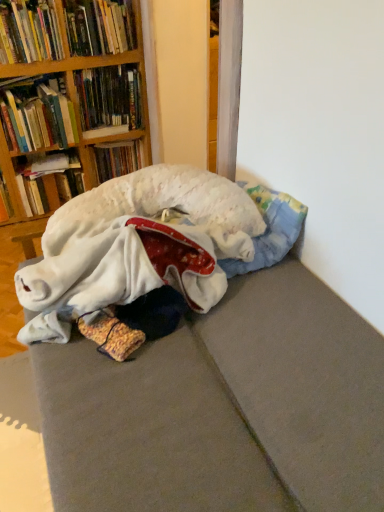
Identify the location of hardcover book at upper left, which ranks as the third book in bottom-to-top order. (118, 159).

Where is `white fluffy dog at center`? This screenshot has width=384, height=512. white fluffy dog at center is located at coordinates (162, 208).

You are a GUI agent. You are given a task and a screenshot of the screen. Output one action in this format:
    pyautogui.click(x=<x>, y=<y>)
    Task: Click on the hardcover book at upper left, the fourth book when ordered from top to bottom
    This screenshot has width=384, height=512.
    Given the screenshot: What is the action you would take?
    pyautogui.click(x=37, y=114)

What is the approximate height of hardcover book at upper left, placed as the 1th book when sorted from top to bottom?

10.44 inches.

Where is `hardcover books at upper left, positioned as the third book in top-to-bottom order`? This screenshot has width=384, height=512. hardcover books at upper left, positioned as the third book in top-to-bottom order is located at coordinates (109, 97).

From the image's perspective, which is below, hardcover book at upper left, marked as the 2th book in a top-to-bottom arrangement, or washed fabric bed at lower left?

From the image's view, washed fabric bed at lower left is below.

In the scene shown: Does hardcover book at upper left, marked as the 2th book in a top-to-bottom arrangement, have a lesser width compared to washed fabric bed at lower left?

Yes.

Is hardcover book at upper left, placed as the sixth book when sorted from bottom to top, facing away from washed fabric bed at lower left?

No, hardcover book at upper left, placed as the sixth book when sorted from bottom to top,'s orientation is not away from washed fabric bed at lower left.

Measure the distance between hardcover book at upper left, placed as the sixth book when sorted from bottom to top, and washed fabric bed at lower left.

A distance of 5.73 feet exists between hardcover book at upper left, placed as the sixth book when sorted from bottom to top, and washed fabric bed at lower left.

From the image's perspective, count 3rd books upward from the hardcover book at upper left, the fourth book from the bottom, and point to it. Please provide its 2D coordinates.

[(99, 26)]

Looking at this image, which of these two, hardcover book at upper left, placed as the 1th book when sorted from top to bottom, or hardcover book at upper left, the fourth book when ordered from top to bottom, is thinner?

Thinner between the two is hardcover book at upper left, placed as the 1th book when sorted from top to bottom.

Is hardcover book at upper left, the fourth book when ordered from top to bottom, at the back of hardcover book at upper left, placed as the 1th book when sorted from top to bottom?

No.

From a real-world perspective, is hardcover book at upper left, which is the 6th book in top-to-bottom order, positioned above or below hardcover books at upper left, acting as the fifth book starting from the bottom?

hardcover book at upper left, which is the 6th book in top-to-bottom order, is below hardcover books at upper left, acting as the fifth book starting from the bottom.

Who is taller, hardcover book at upper left, placed as the second book when sorted from bottom to top, or hardcover books at upper left, acting as the fifth book starting from the bottom?

hardcover books at upper left, acting as the fifth book starting from the bottom, is taller.

Would you say hardcover book at upper left, which is the 6th book in top-to-bottom order, contains hardcover books at upper left, acting as the fifth book starting from the bottom?

No, hardcover books at upper left, acting as the fifth book starting from the bottom, is not surrounded by hardcover book at upper left, which is the 6th book in top-to-bottom order.

From a real-world perspective, which book is the 2nd one above the hardcover book at upper left, which is the 6th book in top-to-bottom order? Please provide its 2D coordinates.

[(109, 97)]

Does hardcover book at left, the first book positioned from the bottom, appear on the right side of hardcover book at upper left, the fourth book from the bottom?

No.

Which of these two, hardcover book at left, the first book positioned from the bottom, or hardcover book at upper left, the fourth book from the bottom, is wider?

Wider between the two is hardcover book at upper left, the fourth book from the bottom.

Is hardcover book at left, the first book positioned from the bottom, taller than hardcover book at upper left, the fourth book when ordered from top to bottom?

No, hardcover book at left, the first book positioned from the bottom, is not taller than hardcover book at upper left, the fourth book when ordered from top to bottom.

Which is in front, hardcover book at left, acting as the seventh book starting from the top, or hardcover book at upper left, the fourth book when ordered from top to bottom?

hardcover book at upper left, the fourth book when ordered from top to bottom, is more forward.

Looking at this image, considering the sizes of hardcover book at upper left, placed as the sixth book when sorted from bottom to top, and hardcover book at upper left, placed as the second book when sorted from bottom to top, in the image, is hardcover book at upper left, placed as the sixth book when sorted from bottom to top, wider or thinner than hardcover book at upper left, placed as the second book when sorted from bottom to top,?

hardcover book at upper left, placed as the sixth book when sorted from bottom to top, is thinner than hardcover book at upper left, placed as the second book when sorted from bottom to top.

Is hardcover book at upper left, placed as the sixth book when sorted from bottom to top, not near hardcover book at upper left, placed as the second book when sorted from bottom to top?

That's not correct — hardcover book at upper left, placed as the sixth book when sorted from bottom to top, is a little close to hardcover book at upper left, placed as the second book when sorted from bottom to top.

Considering the sizes of objects hardcover book at upper left, marked as the 2th book in a top-to-bottom arrangement, and hardcover book at upper left, placed as the second book when sorted from bottom to top, in the image provided, who is taller, hardcover book at upper left, marked as the 2th book in a top-to-bottom arrangement, or hardcover book at upper left, placed as the second book when sorted from bottom to top,?

With more height is hardcover book at upper left, marked as the 2th book in a top-to-bottom arrangement.

Is hardcover book at upper left, the seventh book positioned from the bottom, touching white fluffy dog at center?

No.

From a real-world perspective, is hardcover book at upper left, the seventh book positioned from the bottom, located higher than white fluffy dog at center?

Indeed, from a real-world perspective, hardcover book at upper left, the seventh book positioned from the bottom, stands above white fluffy dog at center.

Considering the positions of objects hardcover book at upper left, the seventh book positioned from the bottom, and white fluffy dog at center in the image provided, who is in front, hardcover book at upper left, the seventh book positioned from the bottom, or white fluffy dog at center?

white fluffy dog at center is in front.

Considering the points (105, 4) and (234, 247), which point is behind, point (105, 4) or point (234, 247)?

Positioned behind is point (105, 4).

From a real-world perspective, relative to hardcover book at upper left, the fourth book when ordered from top to bottom, is hardcover book at upper left, the fifth book positioned from the top, vertically above or below?

hardcover book at upper left, the fifth book positioned from the top, is below hardcover book at upper left, the fourth book when ordered from top to bottom.

Which of these two, hardcover book at upper left, which ranks as the third book in bottom-to-top order, or hardcover book at upper left, the fourth book when ordered from top to bottom, is bigger?

With larger size is hardcover book at upper left, the fourth book when ordered from top to bottom.

Is hardcover book at upper left, which ranks as the third book in bottom-to-top order, positioned with its back to hardcover book at upper left, the fourth book when ordered from top to bottom?

No, hardcover book at upper left, which ranks as the third book in bottom-to-top order, is not facing the opposite direction of hardcover book at upper left, the fourth book when ordered from top to bottom.

Who is more distant, hardcover book at upper left, which ranks as the third book in bottom-to-top order, or hardcover book at upper left, the fourth book when ordered from top to bottom?

hardcover book at upper left, which ranks as the third book in bottom-to-top order, is further from the camera.

Image resolution: width=384 pixels, height=512 pixels. What are the coordinates of `bed frame that is in front of the hardcover book at upper left, marked as the 2th book in a top-to-bottom arrangement` in the screenshot? It's located at (224, 408).

At what (x,y) coordinates should I click in order to perform the action: click on the 3rd book positioned below the hardcover book at upper left, placed as the 1th book when sorted from top to bottom (from the image's perspective). Please return your answer as a coordinate pair (x, y). This screenshot has height=512, width=384. Looking at the image, I should click on (37, 114).

Estimate the real-world distances between objects in this image. Which object is closer to hardcover book at upper left, marked as the 2th book in a top-to-bottom arrangement, hardcover book at upper left, the fifth book positioned from the top, or hardcover book at upper left, the fourth book from the bottom?

hardcover book at upper left, the fourth book from the bottom, is closer to hardcover book at upper left, marked as the 2th book in a top-to-bottom arrangement.

Estimate the real-world distances between objects in this image. Which object is closer to hardcover book at left, the first book positioned from the bottom, hardcover book at upper left, which ranks as the third book in bottom-to-top order, or hardcover book at upper left, which is the 6th book in top-to-bottom order?

Based on the image, hardcover book at upper left, which is the 6th book in top-to-bottom order, appears to be nearer to hardcover book at left, the first book positioned from the bottom.

Considering their positions, is hardcover book at upper left, which is the 6th book in top-to-bottom order, positioned closer to hardcover book at upper left, placed as the 1th book when sorted from top to bottom, than hardcover book at upper left, the fourth book when ordered from top to bottom?

The object closer to hardcover book at upper left, placed as the 1th book when sorted from top to bottom, is hardcover book at upper left, the fourth book when ordered from top to bottom.

Which object lies further to the anchor point hardcover books at upper left, acting as the fifth book starting from the bottom, white fluffy dog at center or hardcover book at upper left, placed as the 1th book when sorted from top to bottom?

white fluffy dog at center is further to hardcover books at upper left, acting as the fifth book starting from the bottom.

When comparing their distances from white fluffy dog at center, does hardcover books at upper left, acting as the fifth book starting from the bottom, or washed fabric bed at lower left seem further?

hardcover books at upper left, acting as the fifth book starting from the bottom, lies further to white fluffy dog at center than the other object.

Estimate the real-world distances between objects in this image. Which object is further from hardcover books at upper left, positioned as the third book in top-to-bottom order, hardcover book at left, acting as the seventh book starting from the top, or washed fabric bed at lower left?

washed fabric bed at lower left is further to hardcover books at upper left, positioned as the third book in top-to-bottom order.

Considering their positions, is hardcover books at upper left, acting as the fifth book starting from the bottom, positioned closer to washed fabric bed at lower left than hardcover book at upper left, the seventh book positioned from the bottom?

Based on the image, hardcover book at upper left, the seventh book positioned from the bottom, appears to be nearer to washed fabric bed at lower left.

Considering their positions, is hardcover book at upper left, marked as the 2th book in a top-to-bottom arrangement, positioned closer to hardcover book at left, acting as the seventh book starting from the top, than hardcover book at upper left, the fourth book from the bottom?

hardcover book at upper left, the fourth book from the bottom, is closer to hardcover book at left, acting as the seventh book starting from the top.

The width and height of the screenshot is (384, 512). In order to click on animal located between washed fabric bed at lower left and hardcover book at upper left, placed as the second book when sorted from bottom to top, in the depth direction in this screenshot , I will do `click(162, 208)`.

Locate an element on the screen. animal between washed fabric bed at lower left and hardcover books at upper left, acting as the fifth book starting from the bottom, from front to back is located at coordinates (162, 208).

This screenshot has height=512, width=384. Identify the location of animal between washed fabric bed at lower left and hardcover book at left, acting as the seventh book starting from the top, along the z-axis. (162, 208).

Find the location of a particular element. animal located between washed fabric bed at lower left and hardcover book at upper left, the fourth book when ordered from top to bottom, in the depth direction is located at coordinates (162, 208).